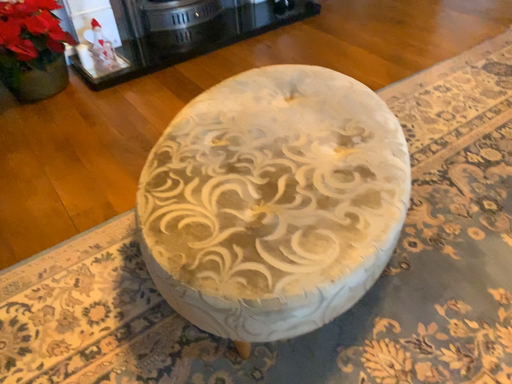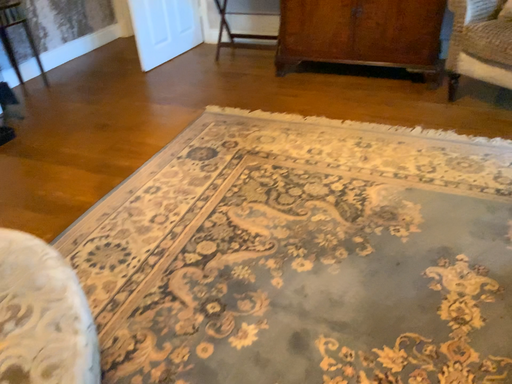
Question: Which way did the camera rotate in the video?

Choices:
 (A) rotated upward
 (B) rotated downward

Answer: (A)